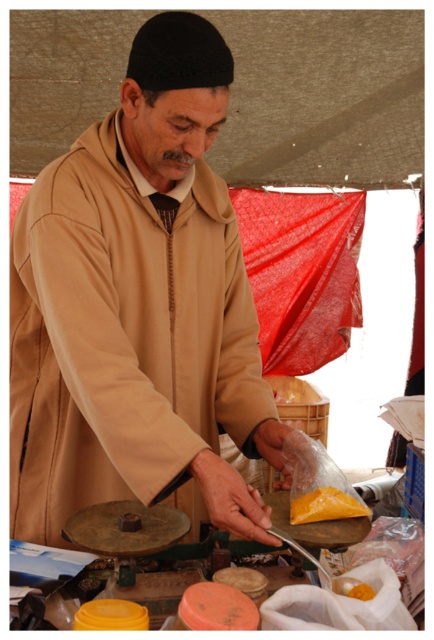
You are a customer at the market and want to buy some spices. The vendor is holding a small plastic bag filled with bright yellow powder. You notice two points marked in the scene. The first point is at coordinates point (259, 524) and the second point is at point (367, 598). Which point is closer to the vendor?

Point (259, 524) is behind point (367, 598), so the closer point to the vendor would be point (367, 598) since it is in front.

You are a customer at the market and want to take a photo of the yellow powder at center. If your camera is 1.17 meters away, is it close enough to capture a clear photo?

The yellow powder at center and camera are 1.17 meters apart from each other, so the distance is sufficient to capture a clear photo as most cameras can focus at that distance.